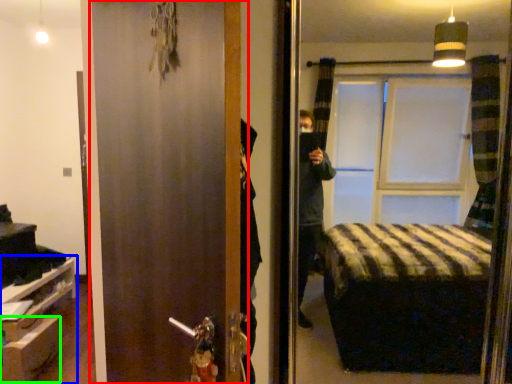
Question: Which object is positioned closest to door (highlighted by a red box)? Select from furniture (highlighted by a blue box) and drawer (highlighted by a green box).

Choices:
 (A) furniture
 (B) drawer

Answer: (B)